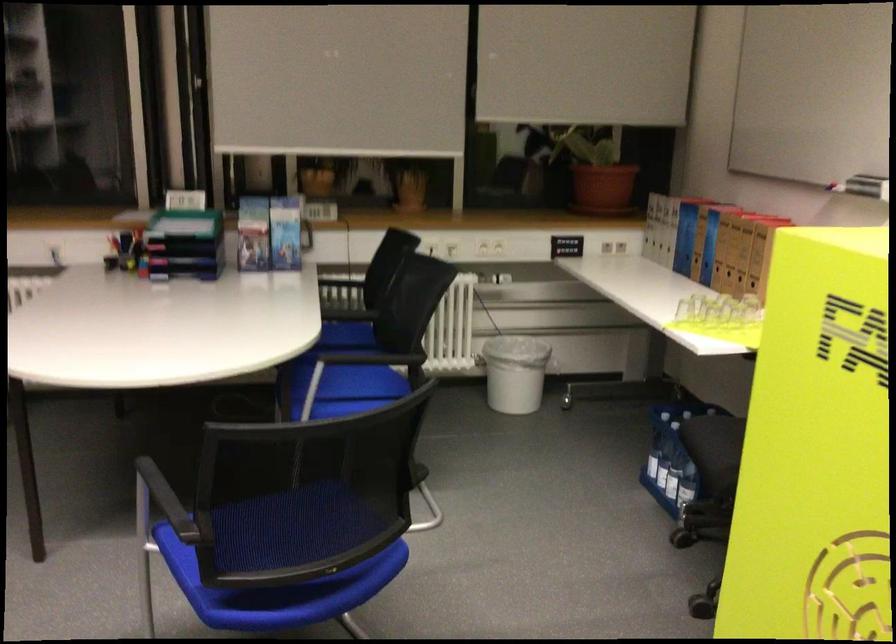
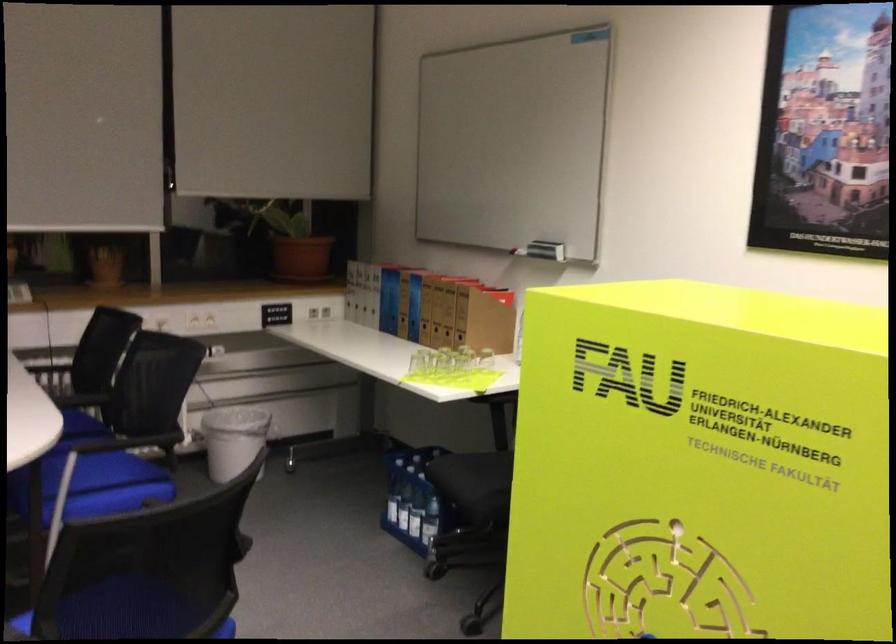
Find the pixel in the second image that matches (691,256) in the first image.

(398, 317)